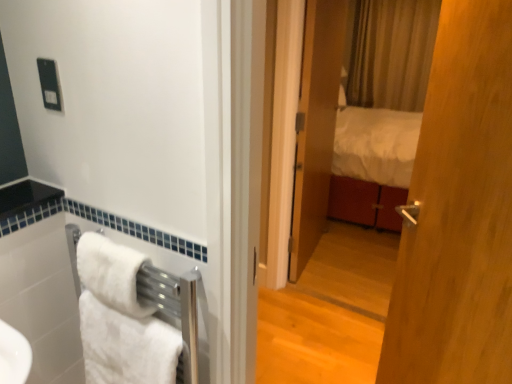
The height and width of the screenshot is (384, 512). Identify the location of vacant region to the left of matte wooden mirror at center. (290, 314).